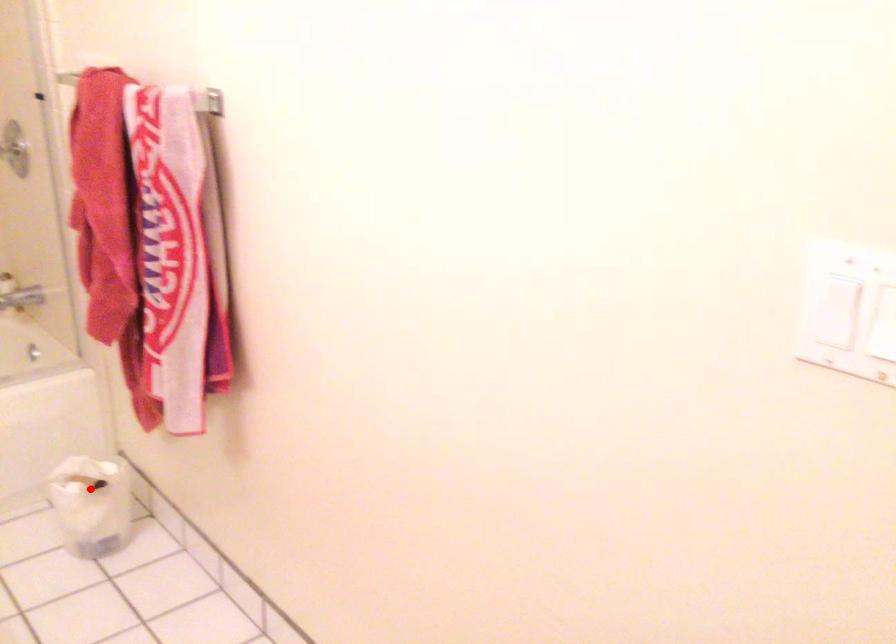
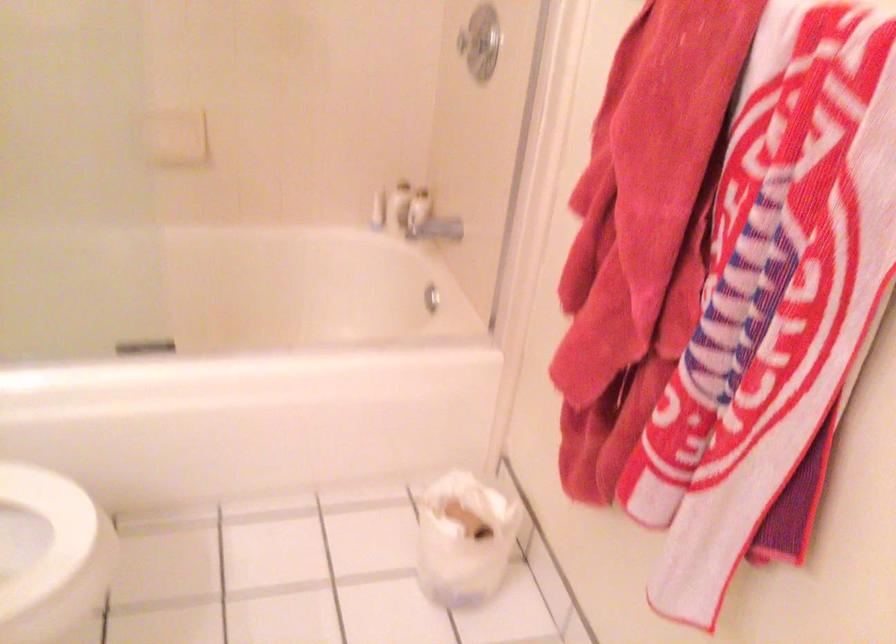
Question: I am providing you with two images of the same scene from different viewpoints. Given a red point in image1, look at the same physical point in image2. Is it:

Choices:
 (A) Closer to the viewpoint
 (B) Farther from the viewpoint

Answer: (A)